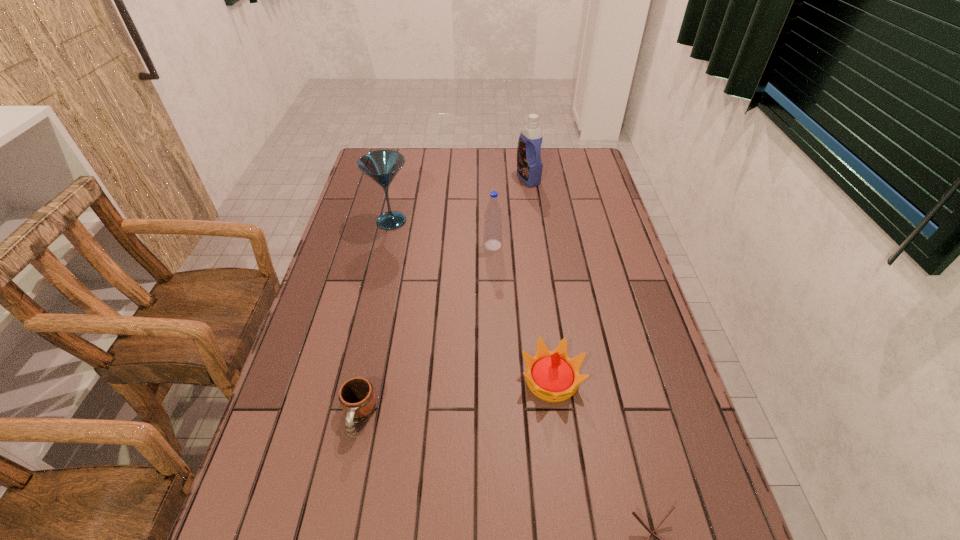
You are a GUI agent. You are given a task and a screenshot of the screen. Output one action in this format:
    pyautogui.click(x=<x>, y=<y>)
    Task: Click on the vacant space positioned on the side of the second shortest object with the handle
    
    Given the screenshot: What is the action you would take?
    pyautogui.click(x=346, y=485)

I want to click on object located at the far edge, so click(529, 164).

Find the location of `martini that is at the left edge`. martini that is at the left edge is located at coordinates (382, 166).

I want to click on mug located at the left edge, so click(357, 397).

What are the coordinates of `vacant region at the far edge` in the screenshot? It's located at (430, 149).

You are a GUI agent. You are given a task and a screenshot of the screen. Output one action in this format:
    pyautogui.click(x=<x>, y=<y>)
    Task: Click on the vacant area at the left edge of the desktop
    This screenshot has height=540, width=960.
    Given the screenshot: What is the action you would take?
    pyautogui.click(x=324, y=422)

I want to click on free space at the right edge, so click(x=612, y=205).

This screenshot has height=540, width=960. I want to click on vacant area at the far right corner of the desktop, so click(x=567, y=153).

Locate an element on the screen. The width and height of the screenshot is (960, 540). vacant space that's between the second farthest object and the detergent is located at coordinates (460, 200).

Identify the location of free space between the detergent and the mug. (444, 297).